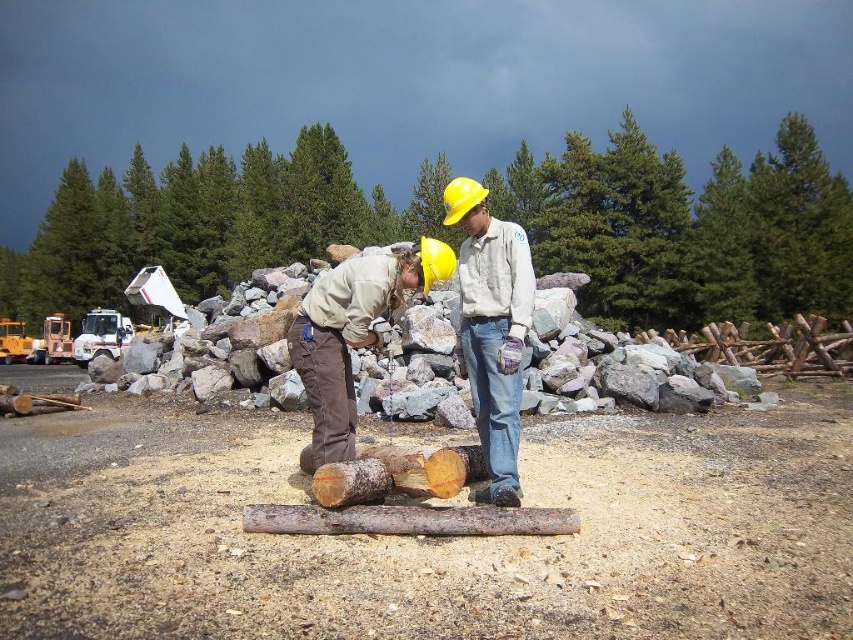
Looking at this image, you are a construction worker assessing the materials available at the site. You have to choose between the brown rough wood at center and the rusty wood log at center for a project that requires a stronger, more durable material. Which one should you select and why?

The brown rough wood at center is larger in size than the rusty wood log at center, but the question is about durability. Since the brown rough wood is described as rough, it might be untreated and less durable. The rusty wood log might have metal components due to rust, making it stronger. However, rust indicates corrosion, which weakens the material. Therefore, neither is ideal, but the brown rough wood is larger and possibly denser, making it a better choice for strength.

You are a safety inspector assessing the workspace. You notice the matte khaki shirt at center and the wooden log at center. Which object takes up more space in the scene?

The matte khaki shirt at center is larger in size than the wooden log at center, so it takes up more space in the scene.

You are a safety inspector assessing the workspace. You notice the matte khaki shirt at center and the wooden log at center. Which object has a smaller width according to the scene?

The matte khaki shirt at center has a smaller width than the wooden log at center.